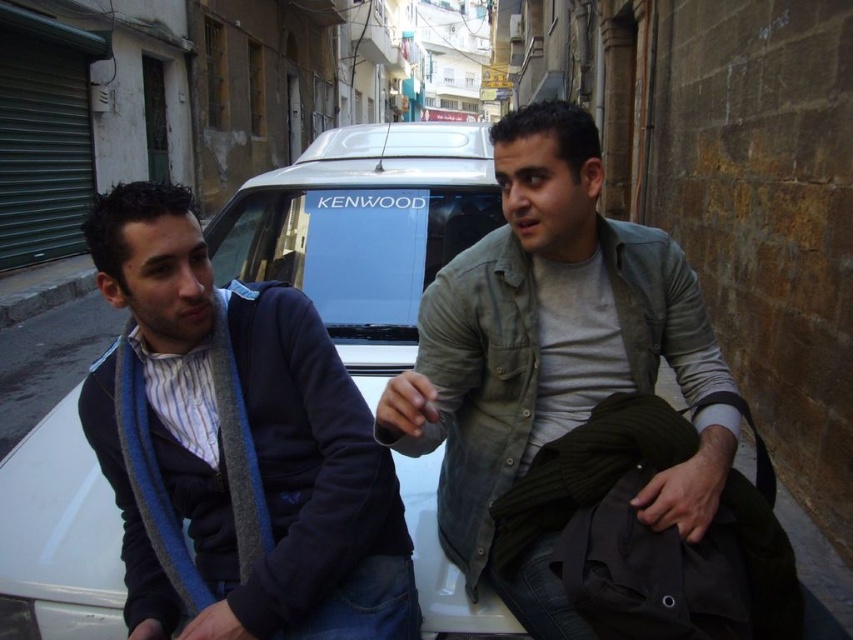
Question: Does gray cotton shirt at center lie behind white matte car at center?

Choices:
 (A) no
 (B) yes

Answer: (A)

Question: Which object appears farthest from the camera in this image?

Choices:
 (A) white matte car at center
 (B) gray cotton shirt at center

Answer: (A)

Question: Observing the image, what is the correct spatial positioning of gray cotton shirt at center in reference to white matte car at center?

Choices:
 (A) below
 (B) above

Answer: (A)

Question: Where is gray cotton shirt at center located in relation to white matte car at center in the image?

Choices:
 (A) right
 (B) left

Answer: (A)